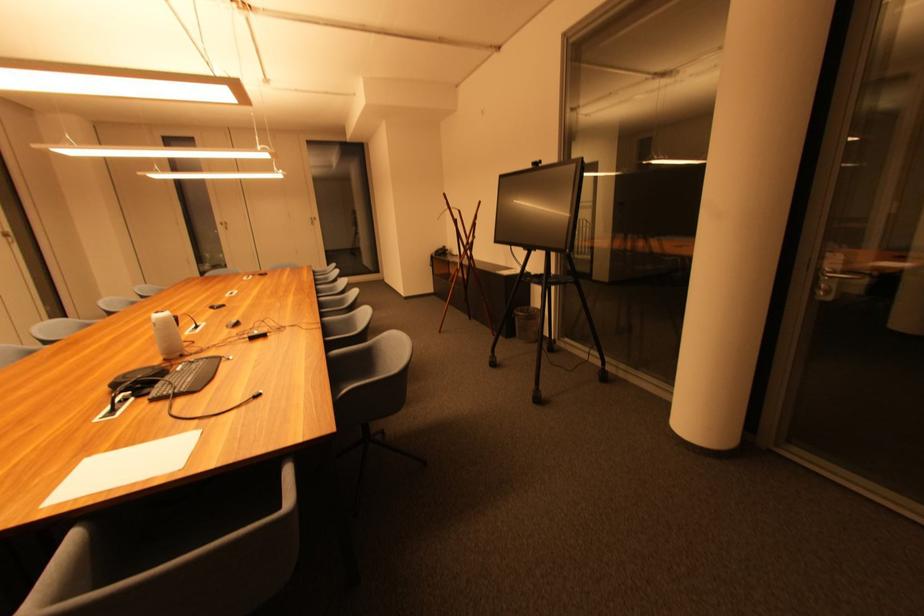
Locate an element on the screen. metal door handle is located at coordinates (854, 282).